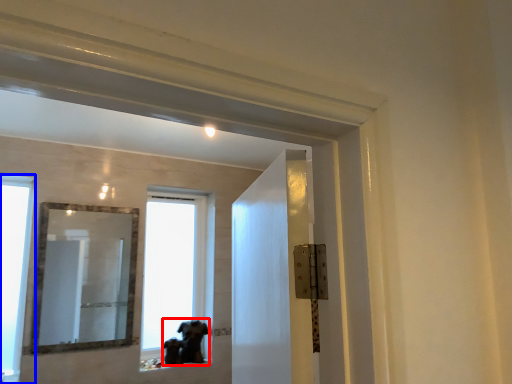
Question: Which object appears farthest to the camera in this image, animal (highlighted by a red box) or window (highlighted by a blue box)?

Choices:
 (A) animal
 (B) window

Answer: (A)